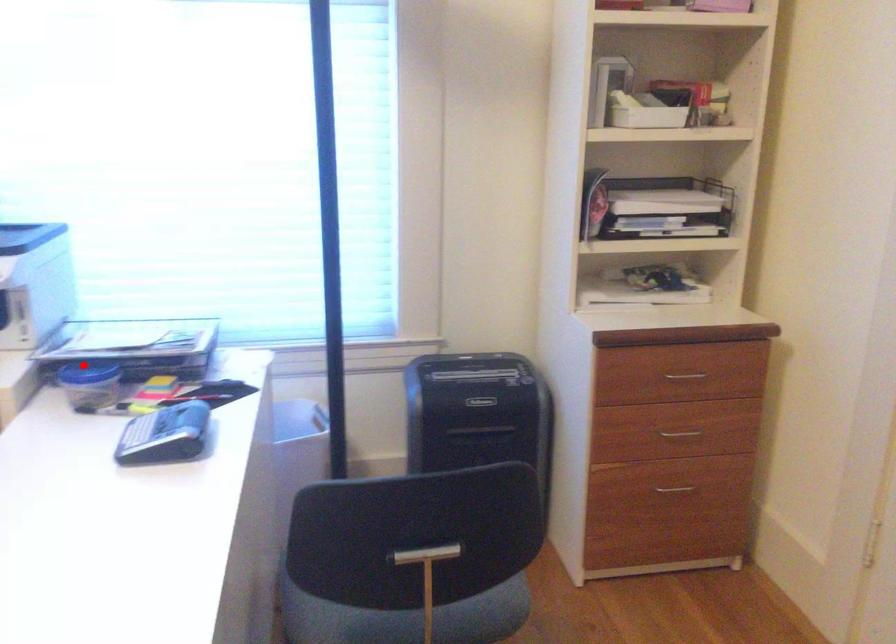
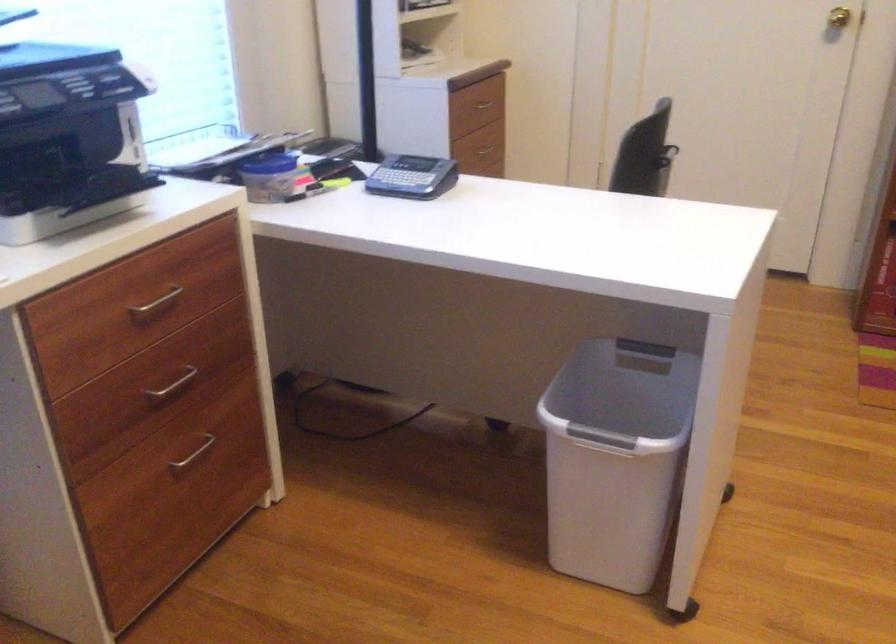
Find the pixel in the second image that matches the highlighted location in the first image.

(270, 164)